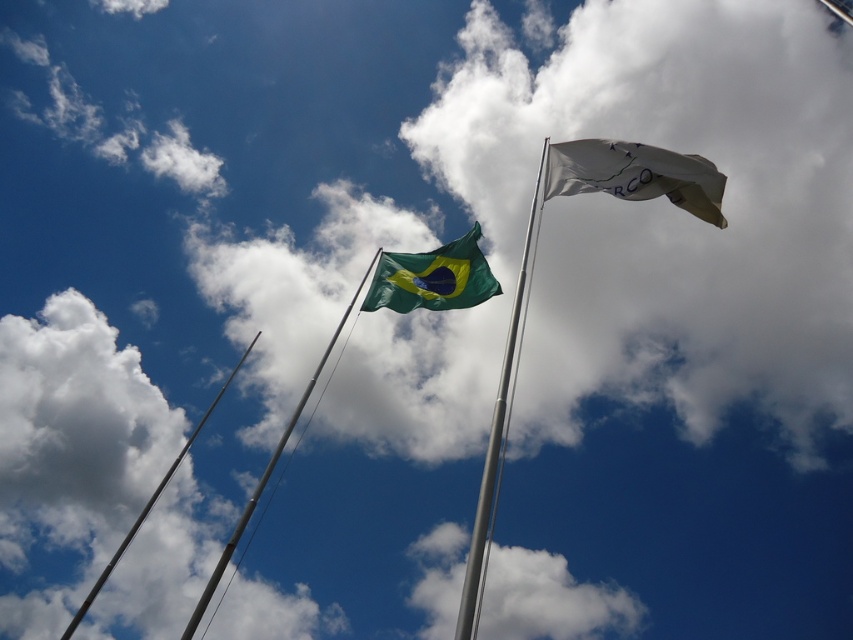
You are a photographer trying to capture both flags in a single shot. The green fabric flag pole at upper center and the metallic silver flag pole at upper center are both in your viewfinder. Which flag pole appears smaller in the photo?

The green fabric flag pole at upper center appears smaller in the photo because it is smaller than the metallic silver flag pole at upper center.

You are a photographer trying to capture both the silver metallic flag pole at center and the green fabric flag pole at upper center in a single shot. Based on their positions, which flag pole will appear closer to the bottom of the photo?

The silver metallic flag pole at center is located above the green fabric flag pole at upper center, so the green fabric flag pole at upper center will appear closer to the bottom of the photo.

You are standing at the camera position and want to reach the point marked at coordinates point (532, 248). If your walking speed is 1.5 meters per second, how long will it take you to reach that point?

The point point (532, 248) is 87.00 meters away from the camera. At a speed of 1.5 meters per second, it would take approximately 58 seconds to reach it.